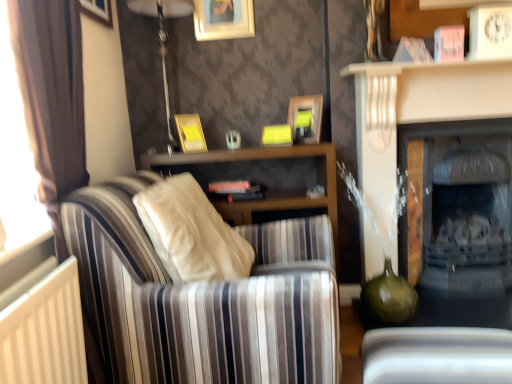
Question: Looking at their shapes, would you say wooden picture frame at upper left, positioned as the fifth picture frame in right-to-left order, is wider or thinner than metallic silver table lamp at upper center?

Choices:
 (A) thin
 (B) wide

Answer: (A)

Question: In terms of height, does wooden picture frame at upper left, the 1th picture frame positioned from the left, look taller or shorter compared to metallic silver table lamp at upper center?

Choices:
 (A) short
 (B) tall

Answer: (A)

Question: Estimate the real-world distances between objects in this image. Which object is closer to the matte black fireplace at right, the 2th fireplace viewed from the front?

Choices:
 (A) matte gold picture frame at upper center, which is counted as the 1th picture frame, starting from the bottom
 (B) white plastic swivel chair at lower right
 (C) wooden picture frame at upper left, the 1th picture frame positioned from the left
 (D) matte white fireplace at right, which appears as the 2th fireplace when viewed from the back
 (E) striped fabric couch at left

Answer: (D)

Question: Based on their relative distances, which object is nearer to the wooden picture frame at upper left, which ranks as the 4th picture frame in bottom-to-top order?

Choices:
 (A) matte gold picture frame at upper center, acting as the fourth picture frame starting from the right
 (B) white plastic swivel chair at lower right
 (C) wooden picture frame at upper center, the third picture frame when ordered from right to left
 (D) yellow matte picture frame at upper center, positioned as the 2th picture frame in bottom-to-top order
 (E) matte black fireplace at right, which is the first fireplace from back to front

Answer: (C)